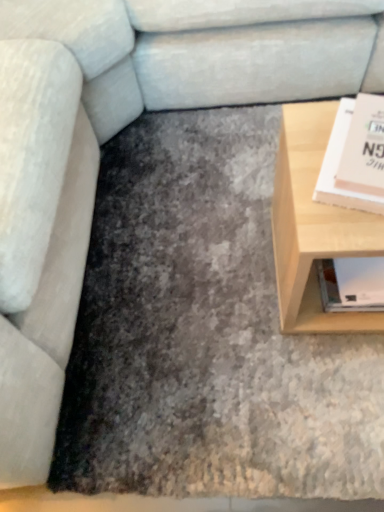
The height and width of the screenshot is (512, 384). I want to click on matte pink paperback book at right, so click(337, 168).

The image size is (384, 512). Describe the element at coordinates (337, 168) in the screenshot. I see `matte pink paperback book at right` at that location.

What is the approximate height of light wood table at right?

It is 40.62 centimeters.

This screenshot has width=384, height=512. Describe the element at coordinates (314, 226) in the screenshot. I see `light wood table at right` at that location.

Where is `light wood table at right`? Image resolution: width=384 pixels, height=512 pixels. light wood table at right is located at coordinates (314, 226).

Where is `matte pink paperback book at right`? This screenshot has width=384, height=512. matte pink paperback book at right is located at coordinates (337, 168).

Is matte pink paperback book at right to the left or to the right of light wood table at right in the image?

matte pink paperback book at right is to the right of light wood table at right.

Is the position of matte pink paperback book at right more distant than that of light wood table at right?

No, matte pink paperback book at right is in front of light wood table at right.

Considering the positions of points (323, 167) and (325, 325), is point (323, 167) closer to camera compared to point (325, 325)?

Yes, point (323, 167) is in front of point (325, 325).

From the image's perspective, would you say matte pink paperback book at right is positioned over light wood table at right?

Yes.

From a real-world perspective, which object rests below the other?

light wood table at right, from a real-world perspective.

Can you confirm if matte pink paperback book at right is thinner than light wood table at right?

Indeed, matte pink paperback book at right has a lesser width compared to light wood table at right.

Considering the sizes of objects matte pink paperback book at right and light wood table at right in the image provided, who is taller, matte pink paperback book at right or light wood table at right?

Standing taller between the two is light wood table at right.

Is matte pink paperback book at right smaller than light wood table at right?

Yes, matte pink paperback book at right is smaller than light wood table at right.

Is matte pink paperback book at right outside of light wood table at right?

matte pink paperback book at right is positioned outside light wood table at right.

Is matte pink paperback book at right in contact with light wood table at right?

No, matte pink paperback book at right is not making contact with light wood table at right.

Is matte pink paperback book at right aimed at light wood table at right?

No, matte pink paperback book at right is not aimed at light wood table at right.

This screenshot has width=384, height=512. I want to click on paperback book that appears above the light wood table at right (from the image's perspective), so click(x=337, y=168).

Looking at this image, would you say light wood table at right is to the left or to the right of matte pink paperback book at right in the picture?

light wood table at right is to the left of matte pink paperback book at right.

Relative to matte pink paperback book at right, is light wood table at right in front or behind?

Visually, light wood table at right is located behind matte pink paperback book at right.

Is point (308, 310) positioned behind point (363, 207)?

Yes, point (308, 310) is behind point (363, 207).

From the image's perspective, is light wood table at right over matte pink paperback book at right?

No, from the image's perspective, light wood table at right is not on top of matte pink paperback book at right.

From a real-world perspective, who is located lower, light wood table at right or matte pink paperback book at right?

From a 3D spatial view, light wood table at right is below.

Which of these two, light wood table at right or matte pink paperback book at right, is thinner?

With smaller width is matte pink paperback book at right.

Is light wood table at right taller than matte pink paperback book at right?

Indeed, light wood table at right has a greater height compared to matte pink paperback book at right.

In the scene shown: Is light wood table at right smaller than matte pink paperback book at right?

No.

Choose the correct answer: Is light wood table at right inside matte pink paperback book at right or outside it?

light wood table at right exists outside the volume of matte pink paperback book at right.

Would you say light wood table at right is a long distance from matte pink paperback book at right?

light wood table at right is actually quite close to matte pink paperback book at right.

Is light wood table at right aimed at matte pink paperback book at right?

No, light wood table at right is not turned towards matte pink paperback book at right.

How far apart are light wood table at right and matte pink paperback book at right?

light wood table at right is 5.36 inches from matte pink paperback book at right.

Identify the location of table beneath the matte pink paperback book at right (from a real-world perspective). The image size is (384, 512). (314, 226).

In order to click on paperback book above the light wood table at right (from a real-world perspective) in this screenshot , I will do `click(337, 168)`.

Where is `table below the matte pink paperback book at right (from the image's perspective)`? table below the matte pink paperback book at right (from the image's perspective) is located at coordinates (314, 226).